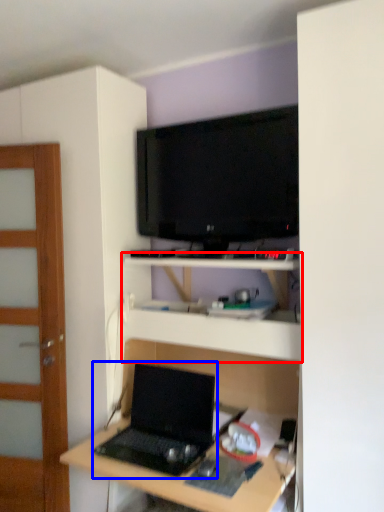
Question: Which object is further to the camera taking this photo, shelf (highlighted by a red box) or laptop (highlighted by a blue box)?

Choices:
 (A) shelf
 (B) laptop

Answer: (A)